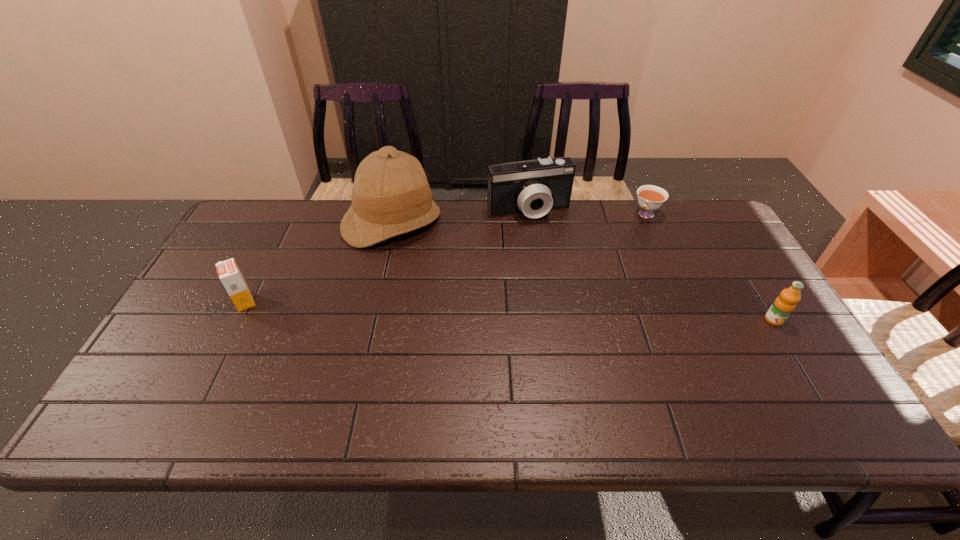
The image size is (960, 540). In order to click on vacant space located 0.330m on the right of the left orange juice in this screenshot , I will do `click(378, 301)`.

Where is `vacant space located on the label of the right orange juice`? The image size is (960, 540). vacant space located on the label of the right orange juice is located at coordinates (817, 392).

Locate an element on the screen. vacant space located 0.300m on the side of the shortest object with the handle is located at coordinates (601, 273).

Find the location of `free space located 0.220m on the side of the shortest object with the handle`. free space located 0.220m on the side of the shortest object with the handle is located at coordinates (612, 258).

At what (x,y) coordinates should I click in order to perform the action: click on vacant position located on the side of the shortest object with the handle. Please return your answer as a coordinate pair (x, y). Image resolution: width=960 pixels, height=540 pixels. Looking at the image, I should click on (608, 264).

Identify the location of vacant space situated 0.320m on the lens of the camcorder. The width and height of the screenshot is (960, 540). (574, 294).

Where is `free space located on the lens of the camcorder`? This screenshot has height=540, width=960. free space located on the lens of the camcorder is located at coordinates (546, 238).

This screenshot has width=960, height=540. In order to click on free space located 0.060m on the lens of the camcorder in this screenshot , I will do `click(545, 236)`.

Find the location of a particular element. The height and width of the screenshot is (540, 960). free region located 0.370m on the front-facing side of the tallest object is located at coordinates (463, 333).

Locate an element on the screen. Image resolution: width=960 pixels, height=540 pixels. vacant space located on the front-facing side of the tallest object is located at coordinates (444, 304).